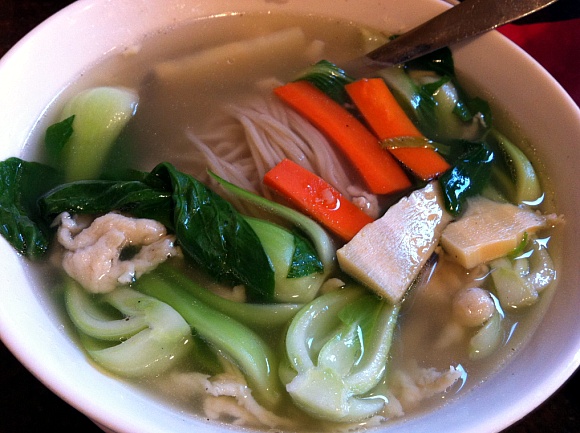
Where is `lip of bowl`? This screenshot has height=433, width=580. lip of bowl is located at coordinates (538, 392).